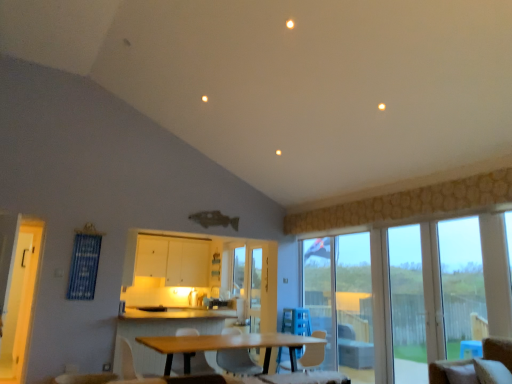
Question: From the image's perspective, is matte gray chair at center, the second chair in the front-to-back sequence, positioned above or below white plastic armchair at lower center, positioned as the second armchair in back-to-front order?

Choices:
 (A) above
 (B) below

Answer: (B)

Question: From a real-world perspective, relative to white plastic armchair at lower center, positioned as the second armchair in back-to-front order, is matte gray chair at center, which is the first chair from left to right, vertically above or below?

Choices:
 (A) below
 (B) above

Answer: (A)

Question: Which object is positioned closest to the yellow wood screen door at left, placed as the 1th screen door when sorted from left to right?

Choices:
 (A) matte gray chair at center, which is the first chair from left to right
 (B) white plastic swivel chair at center
 (C) transparent glass screen door at center, the 1th screen door from the back
 (D) white plastic armchair at center, the 2th armchair positioned from the front
 (E) clear glass door at right, which appears as the 2th window when viewed from the right

Answer: (D)

Question: Which object is the closest to the white plastic armchair at lower center, acting as the first armchair starting from the front?

Choices:
 (A) transparent glass door at right, the 1th window in the right-to-left sequence
 (B) white plastic armchair at center, which is counted as the 1th armchair, starting from the back
 (C) white plastic swivel chair at center
 (D) beige fabric chair at lower right, acting as the first chair starting from the front
 (E) transparent glass door at right

Answer: (B)